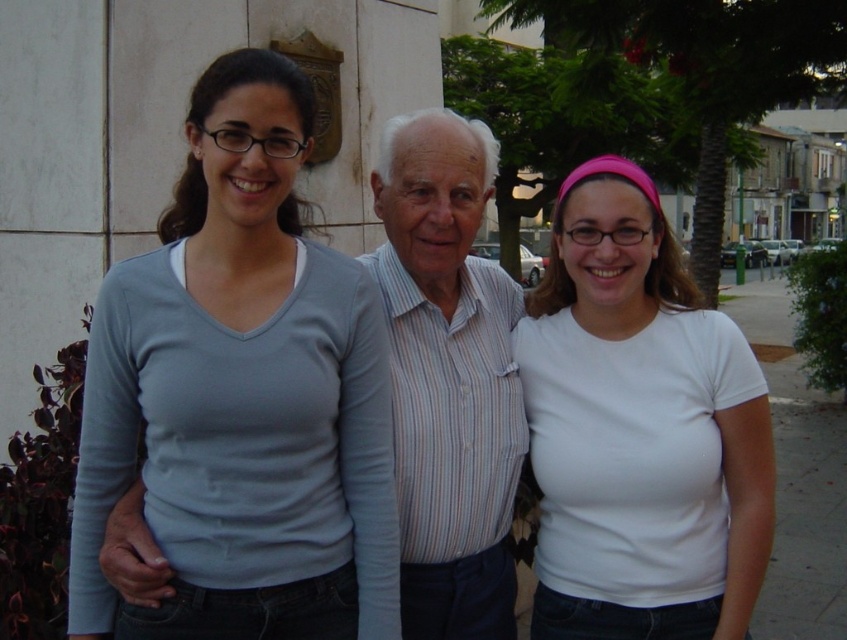
Question: Which point is closer to the camera taking this photo?

Choices:
 (A) (648, 204)
 (B) (475, 378)
 (C) (590, 621)
 (D) (125, 406)

Answer: (D)

Question: Which point appears closest to the camera in this image?

Choices:
 (A) (713, 602)
 (B) (497, 314)
 (C) (361, 508)
 (D) (739, 484)

Answer: (C)

Question: Which of the following is the closest to the observer?

Choices:
 (A) light blue fabric shirt at center
 (B) light blue fabric shirt at left
 (C) white matte t-shirt at center

Answer: (B)

Question: Does light blue fabric shirt at left appear on the right side of striped cotton shirt at center?

Choices:
 (A) no
 (B) yes

Answer: (A)

Question: In this image, where is light blue fabric shirt at center located relative to striped cotton shirt at center?

Choices:
 (A) above
 (B) below

Answer: (B)

Question: Is light blue fabric shirt at center behind striped cotton shirt at center?

Choices:
 (A) yes
 (B) no

Answer: (B)